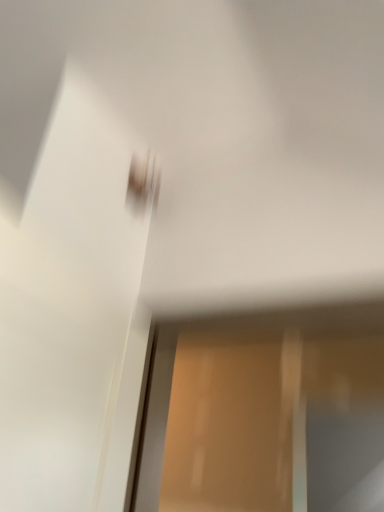
You are a GUI agent. You are given a task and a screenshot of the screen. Output one action in this format:
    pyautogui.click(x=<x>, y=<y>)
    Task: Click on the wooden screen door at lower right
    The image size is (384, 512).
    Given the screenshot: What is the action you would take?
    pyautogui.click(x=245, y=401)

What do you see at coordinates (245, 401) in the screenshot?
I see `wooden screen door at lower right` at bounding box center [245, 401].

This screenshot has width=384, height=512. In order to click on wooden screen door at lower right in this screenshot , I will do `click(245, 401)`.